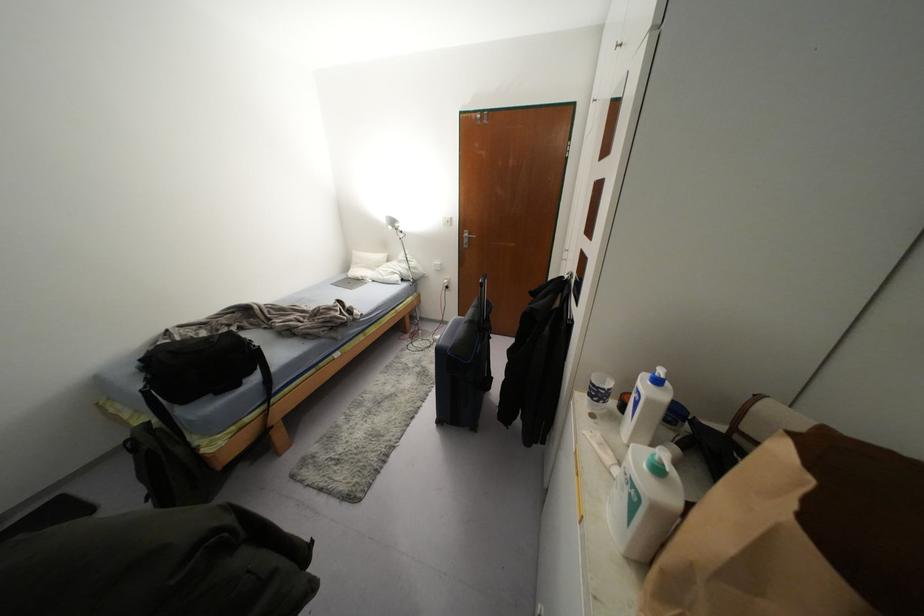
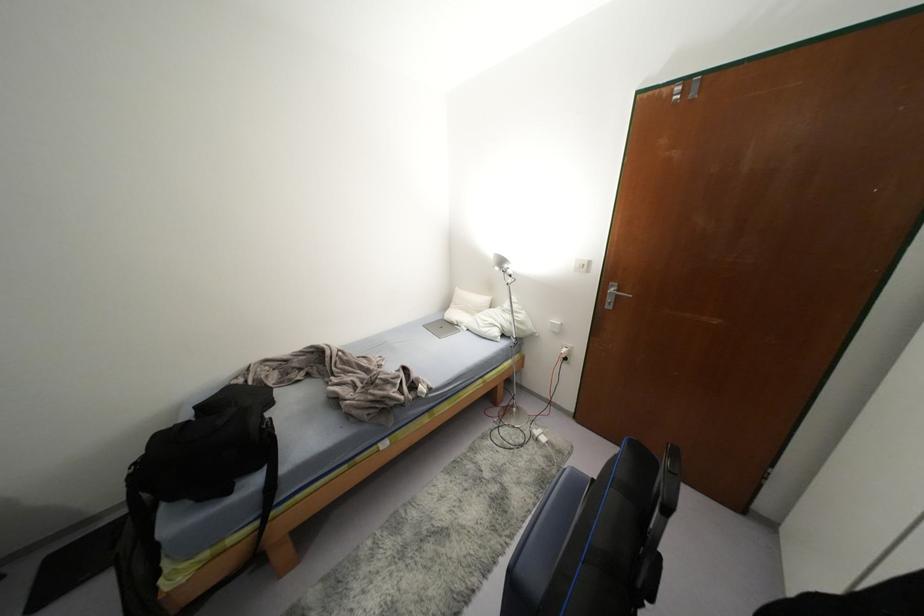
Question: The first image is from the beginning of the video and the second image is from the end. How did the camera likely rotate when shooting the video?

Choices:
 (A) Left
 (B) Right
 (C) Up
 (D) Down

Answer: (A)